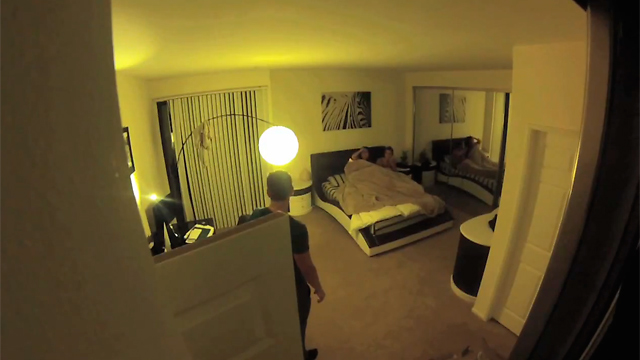
The width and height of the screenshot is (640, 360). In order to click on carpet in this screenshot , I will do `click(342, 263)`, `click(351, 325)`, `click(425, 324)`.